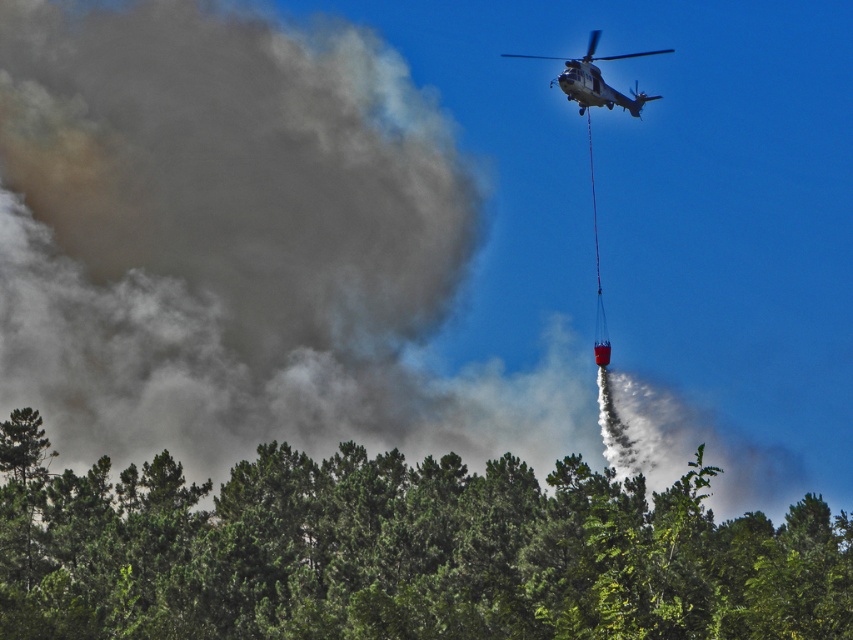
Between green leafy trees at lower center and metallic gray helicopter at upper center, which one has more height?

metallic gray helicopter at upper center is taller.

In the scene shown: Is green leafy trees at lower center to the left of metallic gray helicopter at upper center from the viewer's perspective?

Indeed, green leafy trees at lower center is positioned on the left side of metallic gray helicopter at upper center.

The height and width of the screenshot is (640, 853). What do you see at coordinates (401, 552) in the screenshot?
I see `green leafy trees at lower center` at bounding box center [401, 552].

Locate an element on the screen. The height and width of the screenshot is (640, 853). green leafy trees at lower center is located at coordinates (401, 552).